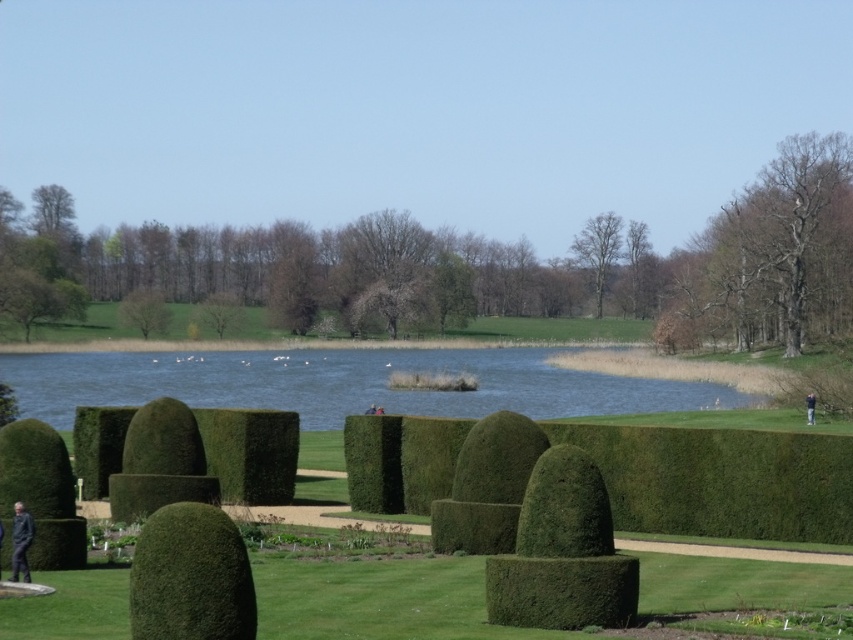
Question: Which point appears farthest from the camera in this image?

Choices:
 (A) (587, 264)
 (B) (10, 557)
 (C) (676, 308)

Answer: (A)

Question: Where is brown leafy tree at center located in relation to blue water at center in the image?

Choices:
 (A) above
 (B) below

Answer: (A)

Question: Can you confirm if brown leafy tree at center is bigger than blue water at center?

Choices:
 (A) no
 (B) yes

Answer: (B)

Question: Can you confirm if dark gray fabric at lower left is positioned to the left of blue fabric person at right?

Choices:
 (A) yes
 (B) no

Answer: (A)

Question: Which object is farther from the camera taking this photo?

Choices:
 (A) blue water at center
 (B) green leafy tree at center
 (C) blue fabric person at right

Answer: (B)

Question: Which is nearer to the dark gray fabric at lower left?

Choices:
 (A) green leafy tree at center
 (B) green leafy hedge at lower left
 (C) bare wood tree at upper right
 (D) blue water at center

Answer: (B)